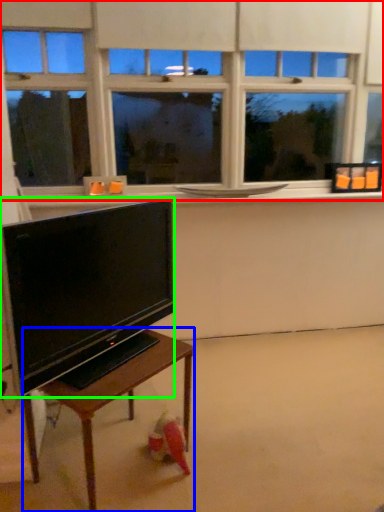
Question: Estimate the real-world distances between objects in this image. Which object is farther from window (highlighted by a red box), table (highlighted by a blue box) or television (highlighted by a green box)?

Choices:
 (A) table
 (B) television

Answer: (A)